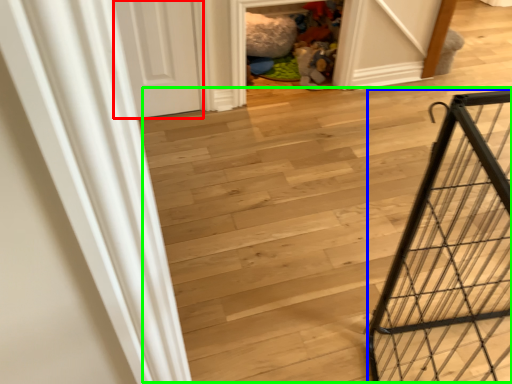
Question: Which object is positioned closest to door (highlighted by a red box)? Select from cage (highlighted by a blue box) and stairwell (highlighted by a green box).

Choices:
 (A) cage
 (B) stairwell

Answer: (B)